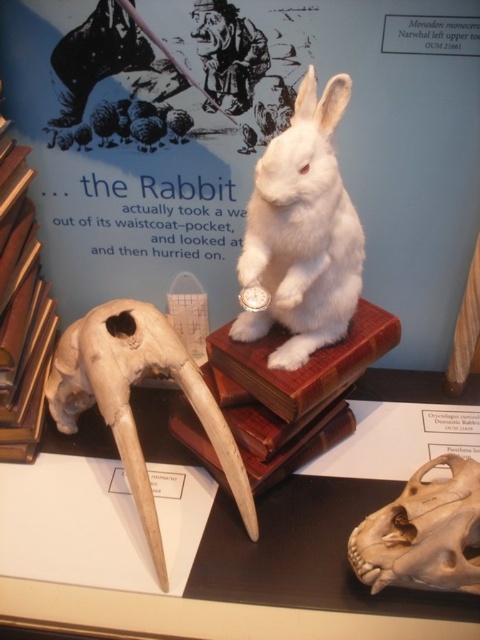
Between brown bone skull at lower right and brown leather book at left, which one has less height?

With less height is brown bone skull at lower right.

Which is more to the right, brown bone skull at lower right or brown leather book at left?

brown bone skull at lower right is more to the right.

The image size is (480, 640). Find the location of `brown bone skull at lower right`. brown bone skull at lower right is located at coordinates [x=423, y=532].

This screenshot has height=640, width=480. I want to click on brown bone skull at lower right, so click(x=423, y=532).

Which is more to the left, white plush rabbit at center or brown leather book at left?

brown leather book at left

Locate an element on the screen. This screenshot has height=640, width=480. white plush rabbit at center is located at coordinates (302, 230).

Locate an element on the screen. The image size is (480, 640). white plush rabbit at center is located at coordinates [x=302, y=230].

Where is `white plush rabbit at center`? The image size is (480, 640). white plush rabbit at center is located at coordinates (302, 230).

Does white matte skull at lower left have a lesser height compared to brown leather book at left?

Correct, white matte skull at lower left is not as tall as brown leather book at left.

Is white matte skull at lower left to the right of brown leather book at left from the viewer's perspective?

Indeed, white matte skull at lower left is positioned on the right side of brown leather book at left.

Is point (137, 448) positioned behind point (0, 298)?

No.

The height and width of the screenshot is (640, 480). In order to click on white matte skull at lower left in this screenshot , I will do `click(129, 397)`.